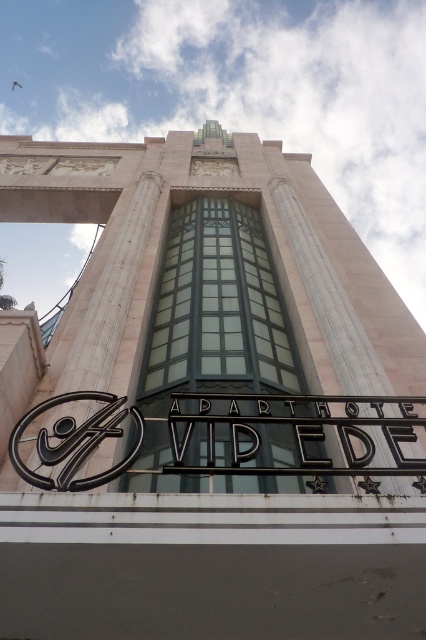
Which is more to the right, black metal sign at center or black glossy logo at center?

black metal sign at center is more to the right.

Find the location of a particular element. black metal sign at center is located at coordinates (293, 433).